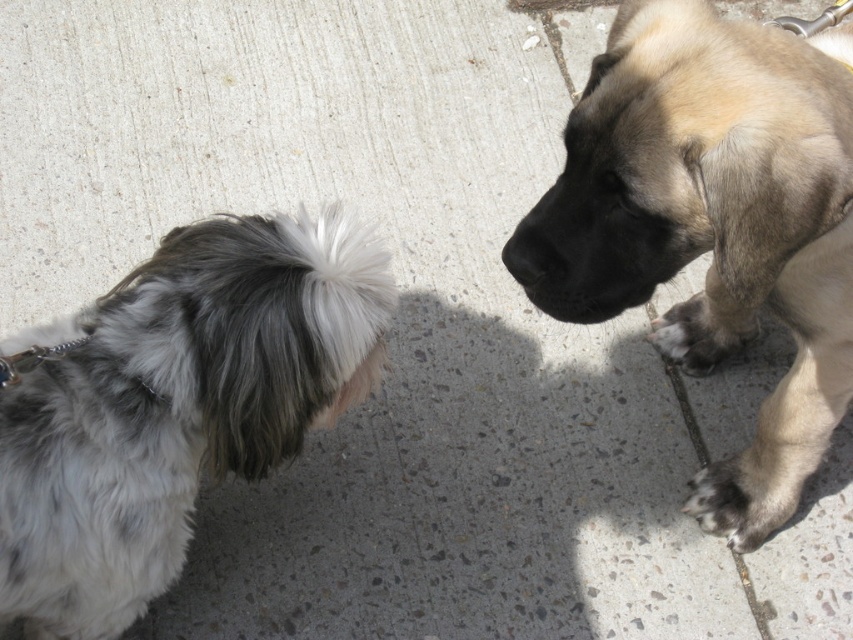
Is light brown fur at center positioned at the back of dark brown fur paw at lower right?

No, it is not.

Can you confirm if light brown fur at center is bigger than dark brown fur paw at lower right?

Indeed, light brown fur at center has a larger size compared to dark brown fur paw at lower right.

Find the location of `light brown fur at center`. light brown fur at center is located at coordinates (717, 224).

Which of these two, gray and white fur at left or dark brown fur paw at lower right, stands shorter?

dark brown fur paw at lower right

Does gray and white fur at left appear under dark brown fur paw at lower right?

Incorrect, gray and white fur at left is not positioned below dark brown fur paw at lower right.

Which is in front, point (109, 333) or point (746, 513)?

Point (109, 333) is in front.

You are a GUI agent. You are given a task and a screenshot of the screen. Output one action in this format:
    pyautogui.click(x=<x>, y=<y>)
    Task: Click on the gray and white fur at left
    
    Given the screenshot: What is the action you would take?
    pyautogui.click(x=175, y=404)

Can you confirm if gray and white fur at left is bigger than fuzzy beige paw at lower right?

Correct, gray and white fur at left is larger in size than fuzzy beige paw at lower right.

Is gray and white fur at left above fuzzy beige paw at lower right?

No, gray and white fur at left is not above fuzzy beige paw at lower right.

Between point (238, 337) and point (743, 328), which one is positioned behind?

The point (743, 328) is behind.

Where is `gray and white fur at left`? The image size is (853, 640). gray and white fur at left is located at coordinates (175, 404).